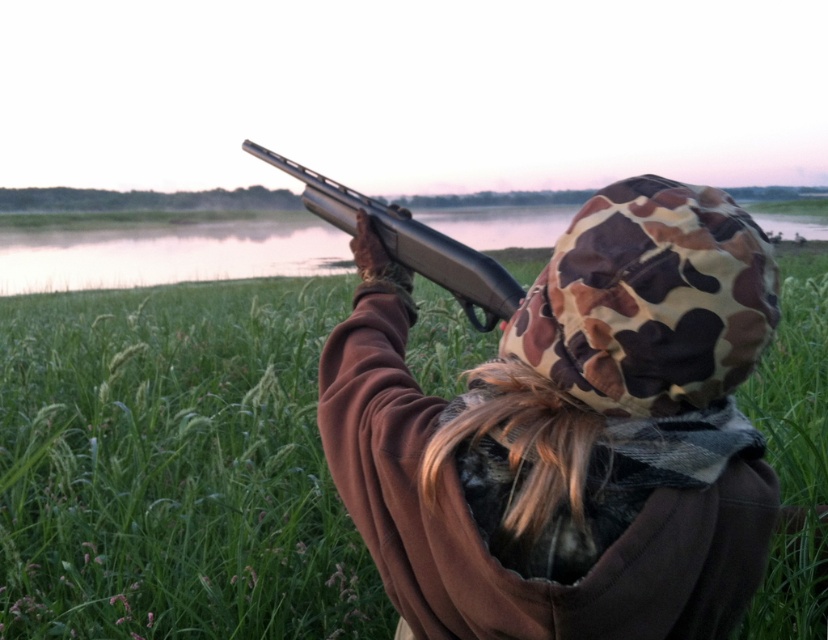
Is brown matte jacket at upper center in front of matte black shotgun at upper center?

That is True.

From the picture: Between brown matte jacket at upper center and matte black shotgun at upper center, which one appears on the right side from the viewer's perspective?

brown matte jacket at upper center is more to the right.

Which is behind, point (503, 598) or point (311, 182)?

The point (311, 182) is more distant.

Locate an element on the screen. This screenshot has width=828, height=640. brown matte jacket at upper center is located at coordinates (570, 433).